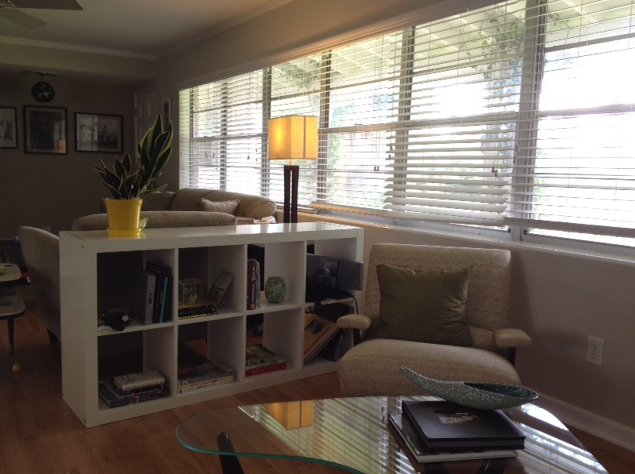
Where is `power outlet`? power outlet is located at coordinates (595, 343).